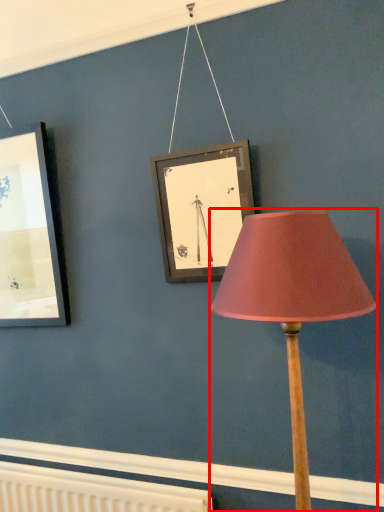
Question: In this image, where is lamp (annotated by the red box) located relative to radiator?

Choices:
 (A) right
 (B) left

Answer: (A)